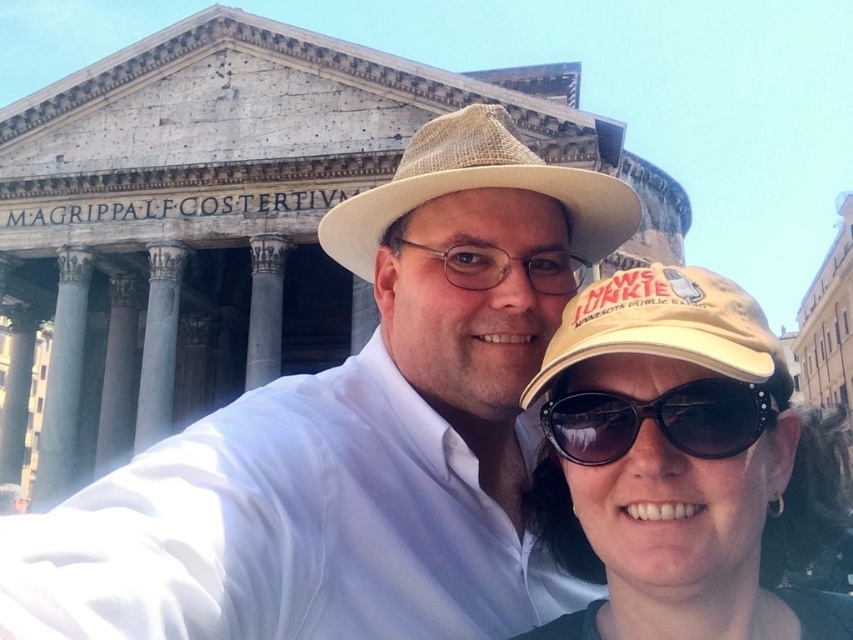
Does white woven hat at center have a lesser width compared to yellow fabric cap at center?

No.

Does white woven hat at center have a larger size compared to yellow fabric cap at center?

Yes.

The width and height of the screenshot is (853, 640). Identify the location of white woven hat at center. (355, 436).

Image resolution: width=853 pixels, height=640 pixels. What are the coordinates of `white woven hat at center` in the screenshot? It's located at tap(355, 436).

Which is more to the left, yellow fabric cap at center or yellow fabric cap at lower right?

yellow fabric cap at lower right is more to the left.

Can you confirm if yellow fabric cap at center is positioned below yellow fabric cap at lower right?

Correct, yellow fabric cap at center is located below yellow fabric cap at lower right.

Is point (666, 266) positioned before point (584, 305)?

Yes, point (666, 266) is in front of point (584, 305).

This screenshot has height=640, width=853. Find the location of `yellow fabric cap at center`. yellow fabric cap at center is located at coordinates (682, 465).

Describe the element at coordinates (682, 465) in the screenshot. The height and width of the screenshot is (640, 853). I see `yellow fabric cap at center` at that location.

Which is behind, point (755, 344) or point (730, 417)?

The point (755, 344) is more distant.

Where is `yellow fabric cap at center`? This screenshot has height=640, width=853. yellow fabric cap at center is located at coordinates (682, 465).